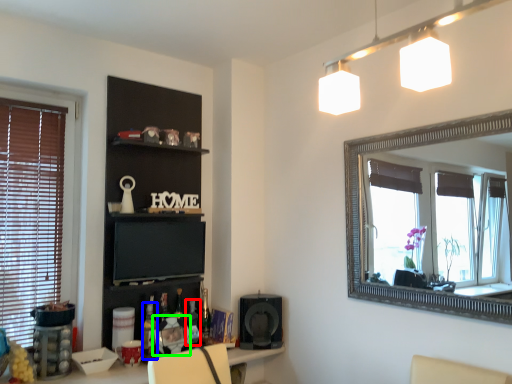
Question: Which is nearer to the bottle (highlighted by a red box)? bottle (highlighted by a blue box) or picture frame (highlighted by a green box).

Choices:
 (A) bottle
 (B) picture frame

Answer: (B)